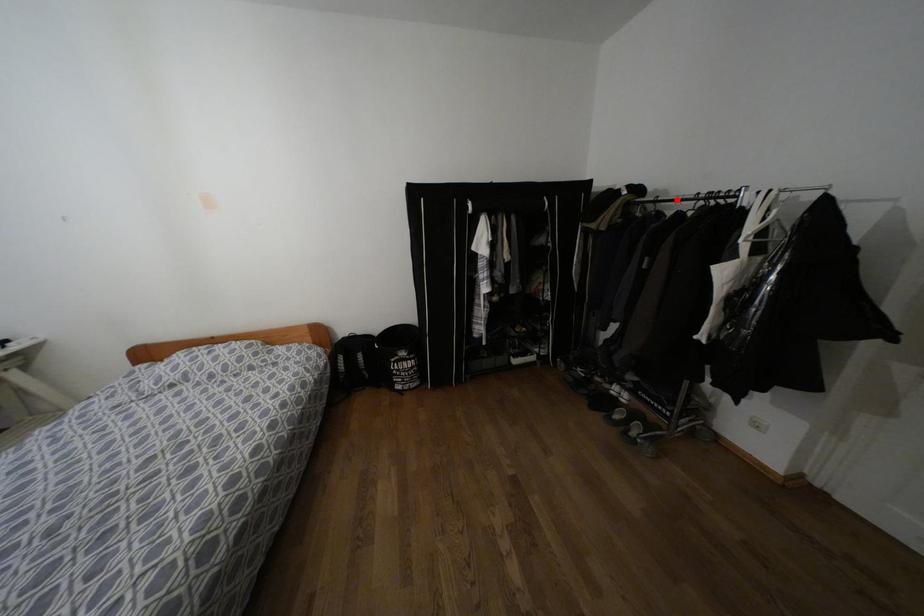
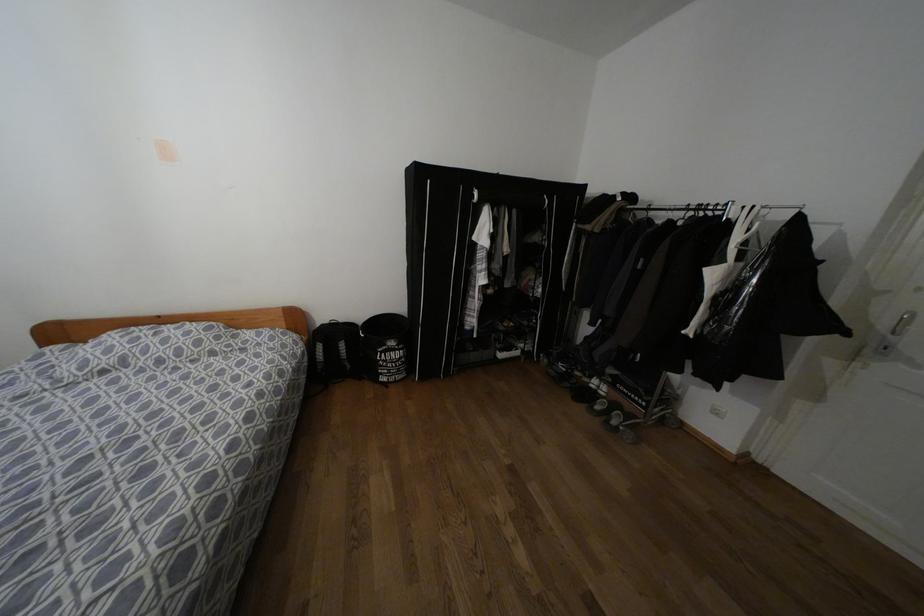
In the second image, find the point that corresponds to the highlighted location in the first image.

(669, 209)